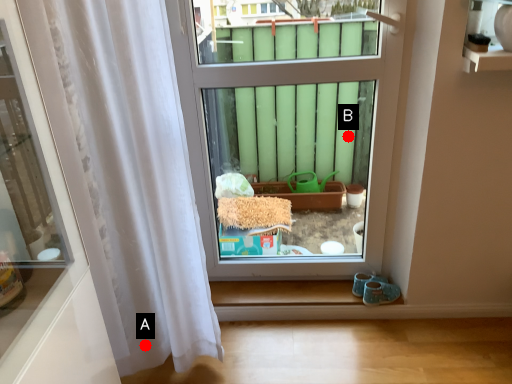
Question: Two points are circled on the image, labeled by A and B beside each circle. Which of the following is the closest to the observer?

Choices:
 (A) A is closer
 (B) B is closer

Answer: (A)